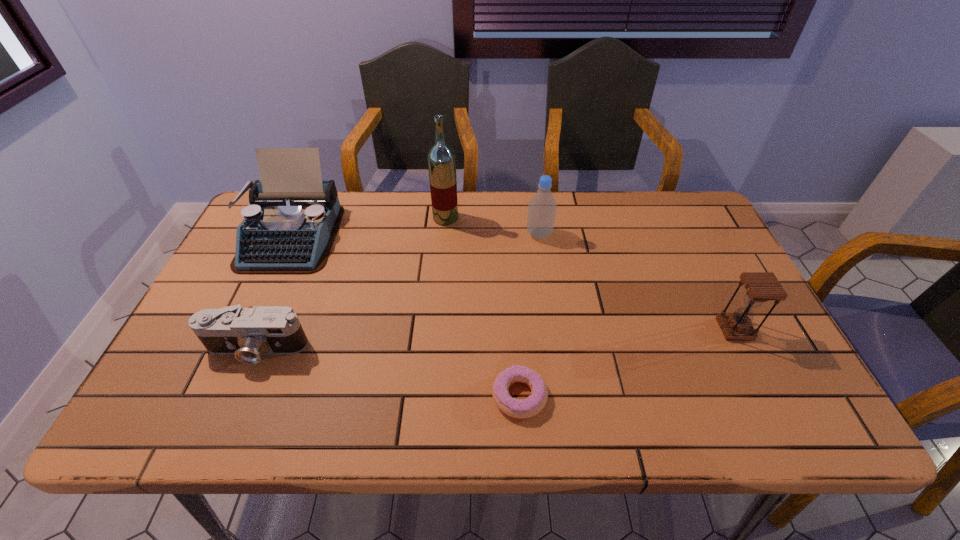
Where is `camera that is at the left edge`? camera that is at the left edge is located at coordinates (248, 333).

This screenshot has height=540, width=960. Identify the location of object positioned at the right edge. (760, 287).

Image resolution: width=960 pixels, height=540 pixels. In order to click on object positioned at the far left corner in this screenshot , I will do `click(289, 227)`.

This screenshot has width=960, height=540. In order to click on free location at the far edge in this screenshot , I will do `click(573, 215)`.

The width and height of the screenshot is (960, 540). I want to click on vacant space at the near edge of the desktop, so tap(483, 398).

In the image, there is a desktop. Identify the location of vacant space at the left edge. The width and height of the screenshot is (960, 540). (244, 298).

The height and width of the screenshot is (540, 960). In the image, there is a desktop. What are the coordinates of `vacant space at the right edge` in the screenshot? It's located at (719, 255).

Locate an element on the screen. free region at the far right corner of the desktop is located at coordinates (655, 211).

Identify the location of vacant region at the near right corner of the desktop. This screenshot has width=960, height=540. (801, 432).

At what (x,y) coordinates should I click in order to perform the action: click on unoccupied area between the bottle and the tallest object. Please return your answer as a coordinate pair (x, y). Looking at the image, I should click on (492, 226).